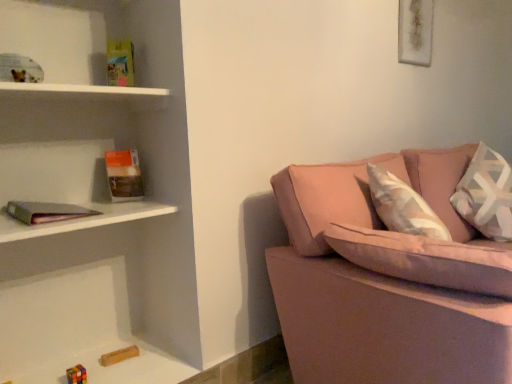
Question: Considering the positions of hardcover book at left and white textured pillow at right in the image, is hardcover book at left taller or shorter than white textured pillow at right?

Choices:
 (A) tall
 (B) short

Answer: (B)

Question: Is point (110, 168) positioned closer to the camera than point (499, 198)?

Choices:
 (A) closer
 (B) farther

Answer: (A)

Question: Estimate the real-world distances between objects in this image. Which object is farther from the hardcover book at left?

Choices:
 (A) matte gray bookshelf at left
 (B) white textured pillow at right
 (C) pink fabric couch at right

Answer: (B)

Question: Which object is positioned closest to the white textured pillow at right?

Choices:
 (A) hardcover book at left
 (B) pink fabric couch at right
 (C) matte gray bookshelf at left

Answer: (B)